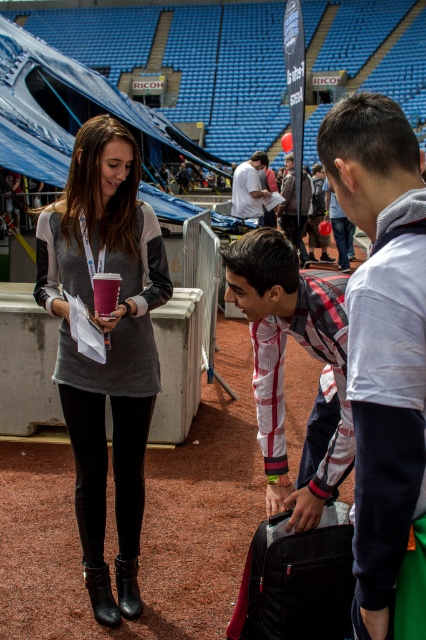
You are a photographer standing behind the dark gray hoodie at right and the plaid fabric shirt at center. You need to take a photo of both people without any obstructions. The camera you are using has a maximum focus range of 80 centimeters. Can you capture both subjects in focus without moving the camera?

The dark gray hoodie at right is 82.51 centimeters from the plaid fabric shirt at center. Since the distance between them exceeds the camera maximum focus range of 80 centimeters, you cannot capture both subjects in focus without moving the camera.

You are attending an event at the stadium and need to locate two people based on their clothing. The dark gray hoodie at right and the plaid fabric shirt at center. Can you tell me which one is positioned higher in the image?

The dark gray hoodie at right is located above the plaid fabric shirt at center in the image.

You are a photographer at the stadium and need to adjust the lighting to ensure both the gray matte sweater at center and the white cotton shirt at center are visible. Which clothing item is positioned lower on the person to help you focus the camera accordingly?

The gray matte sweater at center is below the white cotton shirt at center, so it is positioned lower on the person. Adjust the camera focus to account for its lower position.